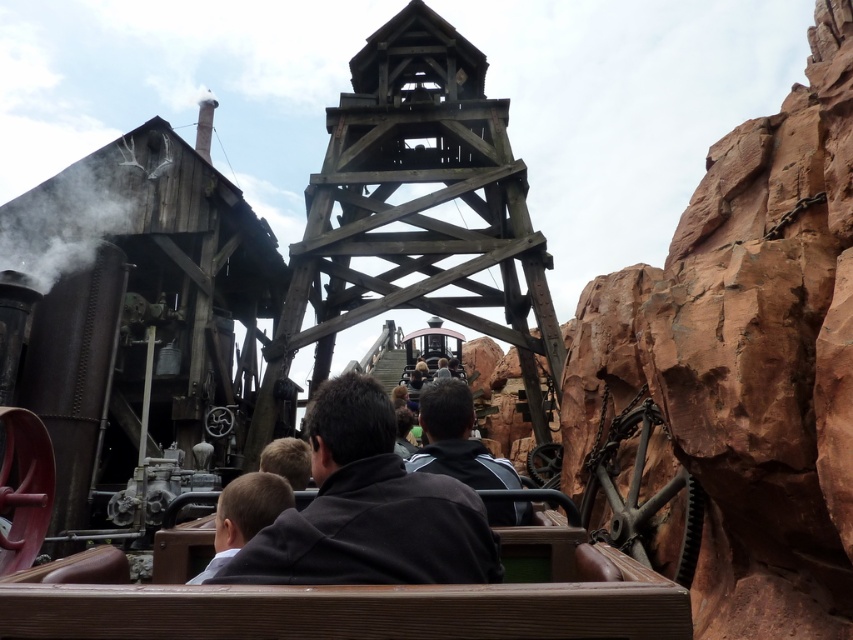
You are a photographer standing at the entrance of the amusement park ride. You want to take a photo of the dark gray hoodie at center and the light brown leather jacket at lower center so that both are fully visible in the frame. Based on their heights, which one might you need to adjust your camera angle to ensure it is fully captured?

The dark gray hoodie at center is much taller than the light brown leather jacket at lower center, so you might need to adjust your camera angle to capture the full height of the dark gray hoodie at center.

You are a guest at the amusement park and want to take a photo of the rusty metal steam engine at left while standing near the light brown leather jacket at lower center. Can you see the entire steam engine in your photo without moving your position?

The rusty metal steam engine at left is above the light brown leather jacket at lower center, so you can see the entire steam engine in your photo while standing near the light brown leather jacket at lower center without needing to move.

From the picture: You are a photographer trying to capture a clear shot of the dark gray fabric at center and the dark gray hoodie at center. Since you want to focus on the smaller object, which one should you aim for?

The dark gray fabric at center occupies less space than the dark gray hoodie at center, so you should aim for the dark gray fabric at center to focus on the smaller object.